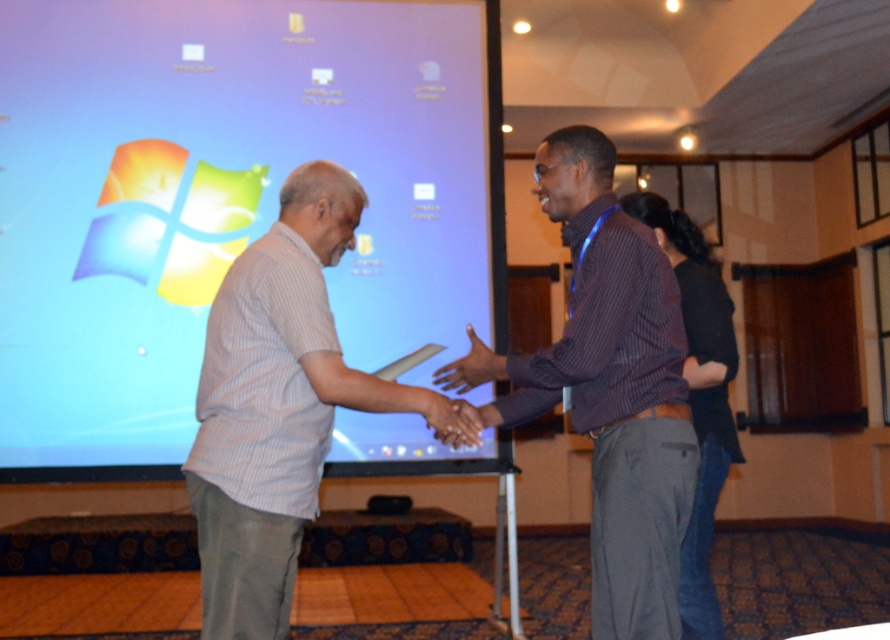
You are an event photographer at a tech conference. You need to capture a photo of the blue glossy projection screen at upper left and the matte black hand at center. Can you frame both objects in the same shot without any overlap?

The blue glossy projection screen at upper left is positioned over matte black hand at center, so they are overlapping in the image. Therefore, you cannot frame both objects in the same shot without overlap.

You are an event planner setting up for a tech conference. You need to ensure that the blue glossy projection screen at upper left is visible to all attendees. Considering the striped cotton shirt at center is worn by a speaker, will the speaker block the view of the screen?

The blue glossy projection screen at upper left is above the striped cotton shirt at center, so the speaker wearing the striped cotton shirt at center will not block the view of the screen since it is positioned higher up.